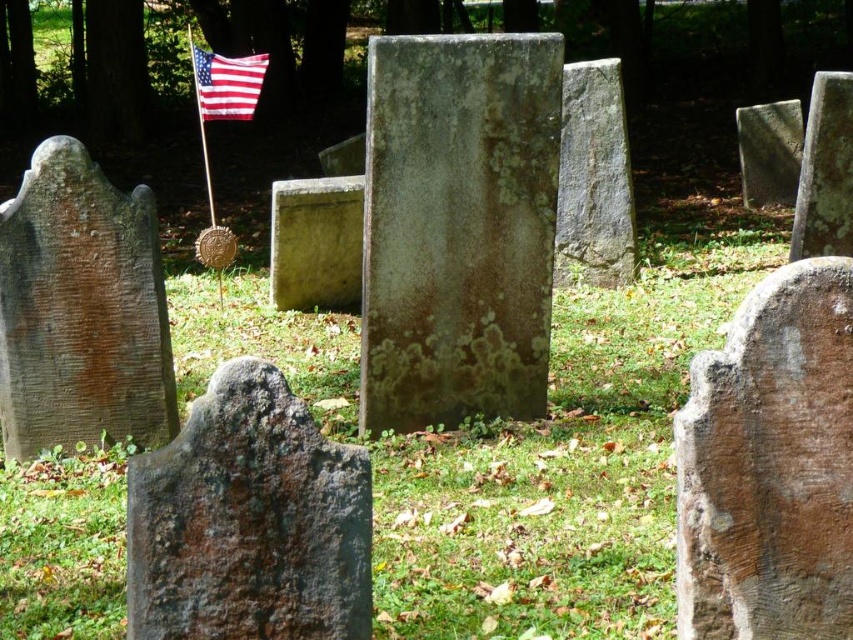
Question: Where is green mossy grass at center located in relation to brown rough stone gravestone at right in the image?

Choices:
 (A) right
 (B) left

Answer: (B)

Question: Estimate the real-world distances between objects in this image. Which object is farther from the rusty stone gravestone at center?

Choices:
 (A) american flag at upper left
 (B) gray stone gravestone at center
 (C) brown stone gravestone at left
 (D) green mossy stone at center

Answer: (A)

Question: Which of the following is the farthest from the observer?

Choices:
 (A) brown rough stone gravestone at right
 (B) american flag at upper left

Answer: (B)

Question: Which point appears farthest from the camera in this image?

Choices:
 (A) (312, 588)
 (B) (537, 333)

Answer: (B)

Question: Is green mossy grass at center to the left of green mossy stone at center from the viewer's perspective?

Choices:
 (A) yes
 (B) no

Answer: (B)

Question: Where is green mossy stone at center located in relation to rusty stone gravestone at center in the image?

Choices:
 (A) right
 (B) left

Answer: (A)